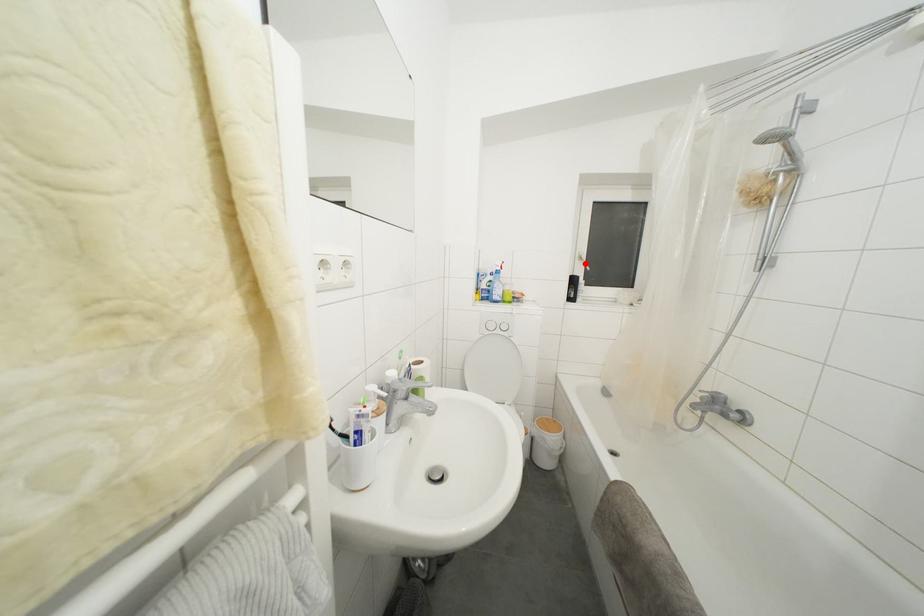
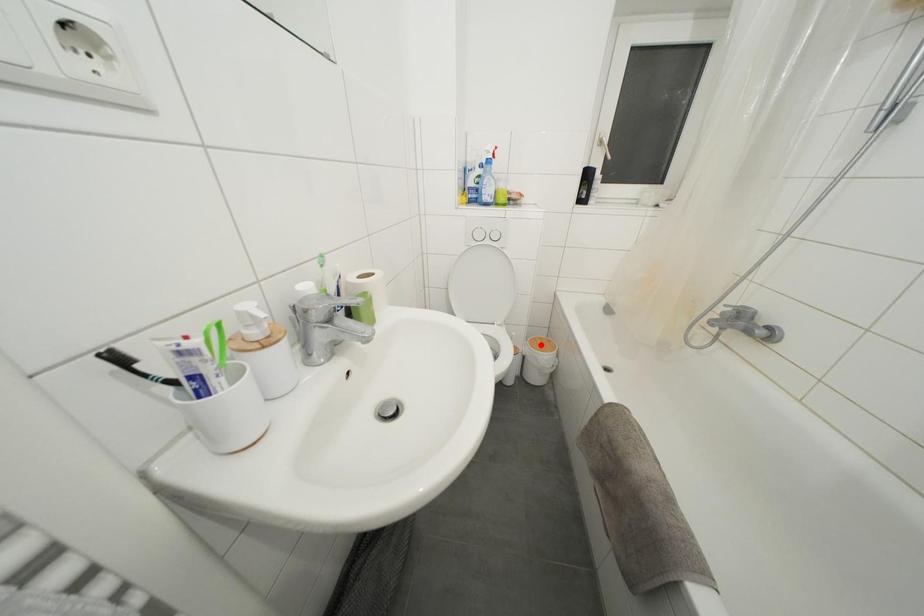
I am providing you with two images of the same scene from different viewpoints. A red point is marked on the first image and another point is marked on the second image. Is the red point in image1 aligned with the point shown in image2?

No